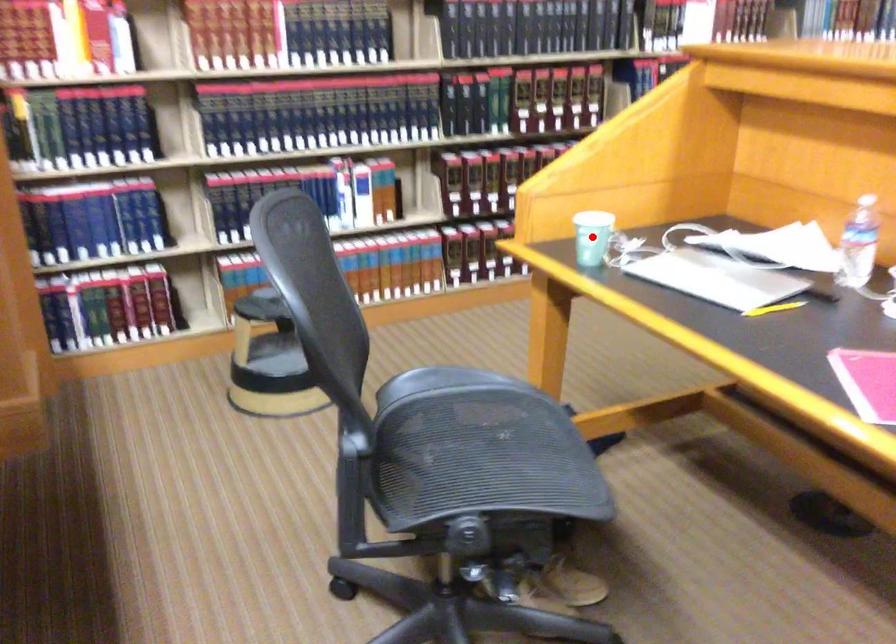
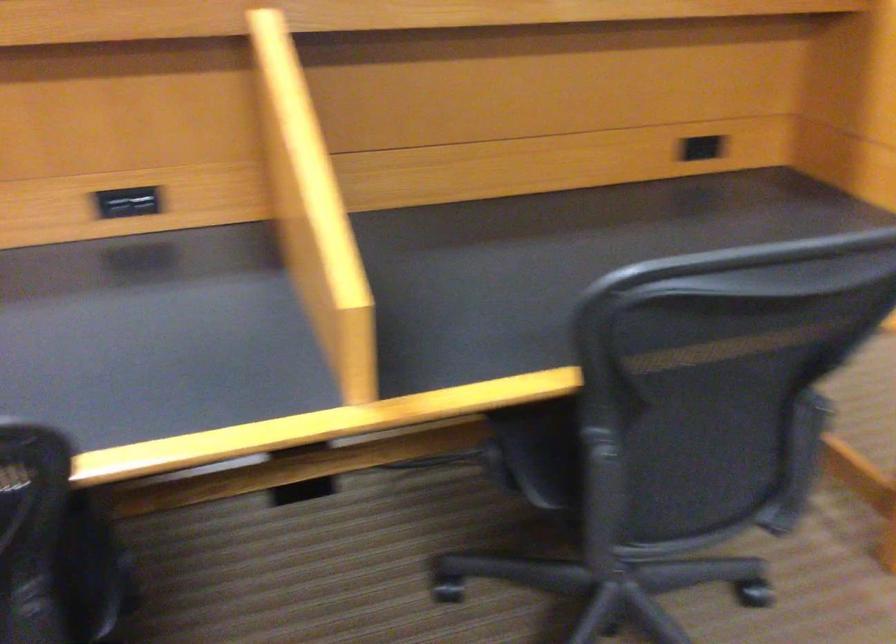
Question: I am providing you with two images of the same scene from different viewpoints. A red point is marked on the first image. Is the red point's position out of view in image 2?

Choices:
 (A) Yes
 (B) No

Answer: (A)